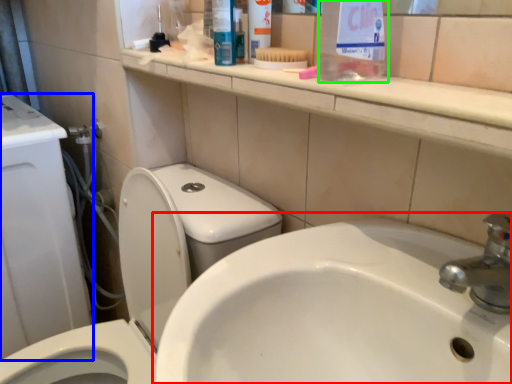
Question: Considering the real-world distances, which object is closest to sink (highlighted by a red box)? porcelain (highlighted by a blue box) or cleaning product (highlighted by a green box).

Choices:
 (A) porcelain
 (B) cleaning product

Answer: (B)